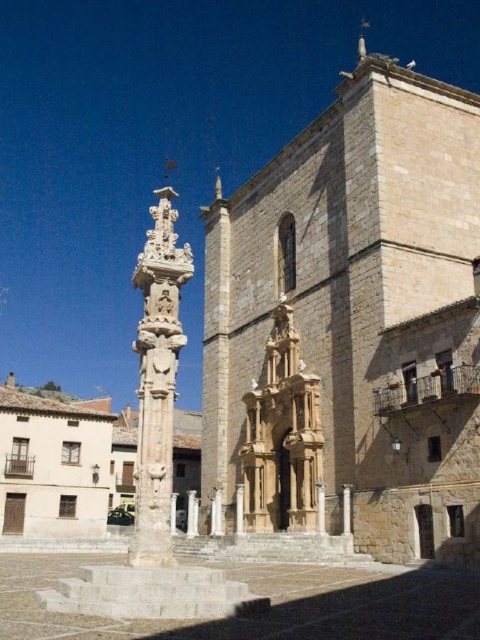
You are standing at the point marked as point (170, 317) in the image. The plaza has a tall stone column on the left and a large stone building on the right. You want to walk to the nearest entrance. Which direction should you head towards?

The point (170, 317) is 31.44 meters away from the nearest entrance. Since the plaza has a tall stone column on the left and a large stone building on the right, you should head towards the entrance of the large stone building on the right as it is closer than the column on the left.

You are a tourist standing in the plaza and want to take a photo of both the point at coordinates point (57, 504) and point (276, 508). Which point should you focus on first to ensure both are in the frame?

You should focus on point (57, 504) first because it is closer to you than point (276, 508), ensuring both points are within the camera frame.

You are an architect planning to install a new pathway between the light brown stone church at center and the white stone column at center. The pathway must be 3 meters wide. Is there enough space between them to accommodate this pathway?

The light brown stone church at center and white stone column at center are 32.40 meters apart. Subtracting the width of the pathway, there would still be 29.40 meters of space remaining between them, which is sufficient. Therefore, the pathway can be installed.